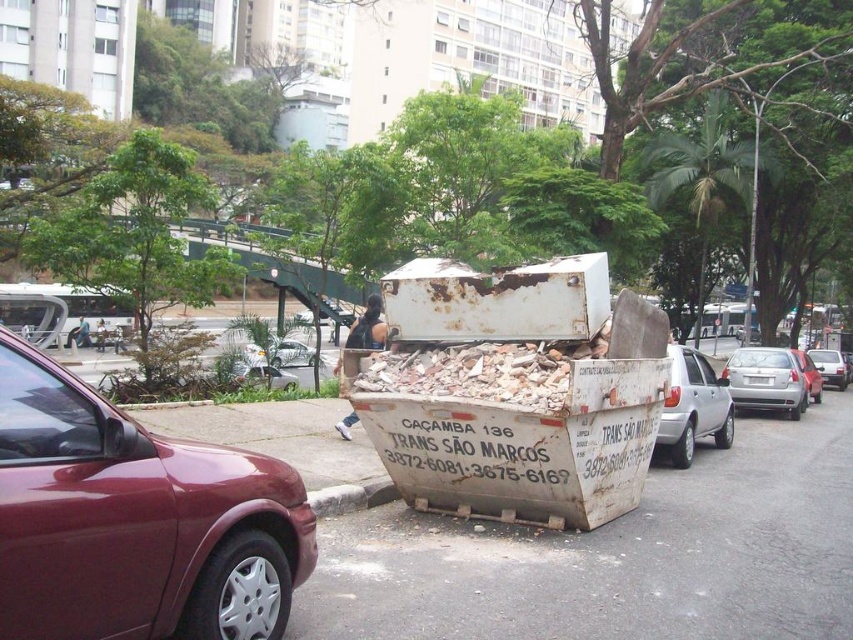
This screenshot has width=853, height=640. What do you see at coordinates (766, 380) in the screenshot?
I see `silver metallic sedan at center-right` at bounding box center [766, 380].

Is the position of silver metallic sedan at center-right more distant than that of metallic silver sedan at center?

That is False.

Which is behind, point (782, 404) or point (802, 356)?

The point (802, 356) is more distant.

I want to click on silver metallic sedan at center-right, so click(x=766, y=380).

Who is more distant from viewer, (666, 448) or (839, 378)?

The point (839, 378) is more distant.

Does white matte car at right have a larger size compared to metallic silver sedan at right?

Incorrect, white matte car at right is not larger than metallic silver sedan at right.

Find the location of `white matte car at right`. white matte car at right is located at coordinates (693, 406).

Identify the location of white matte car at right. This screenshot has width=853, height=640. (693, 406).

Can you confirm if maroon metallic car at left is shorter than gray concrete curb at lower center?

No.

Is maroon metallic car at left below gray concrete curb at lower center?

Incorrect, maroon metallic car at left is not positioned below gray concrete curb at lower center.

Find the location of a particular element. The width and height of the screenshot is (853, 640). maroon metallic car at left is located at coordinates (135, 520).

Find the location of `maroon metallic car at left`. maroon metallic car at left is located at coordinates (135, 520).